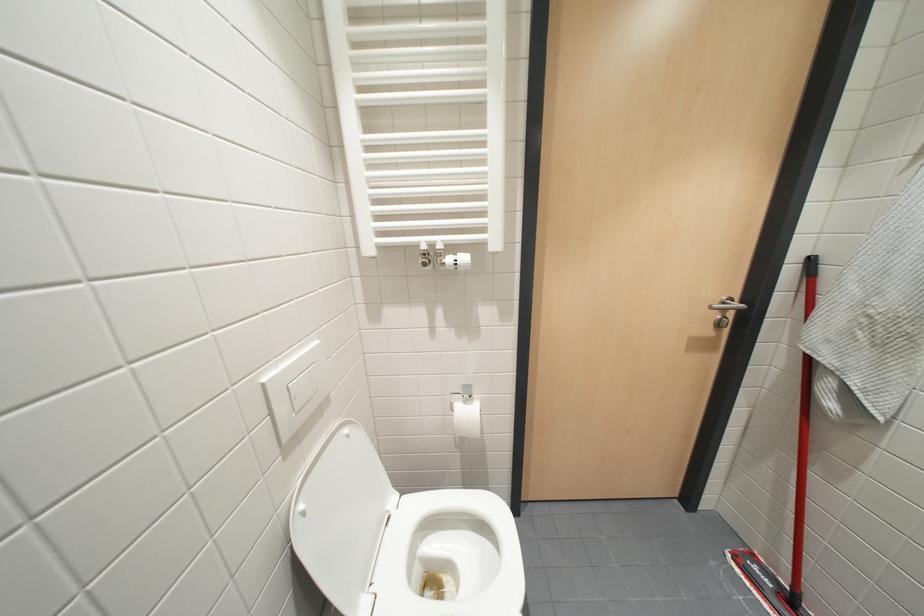
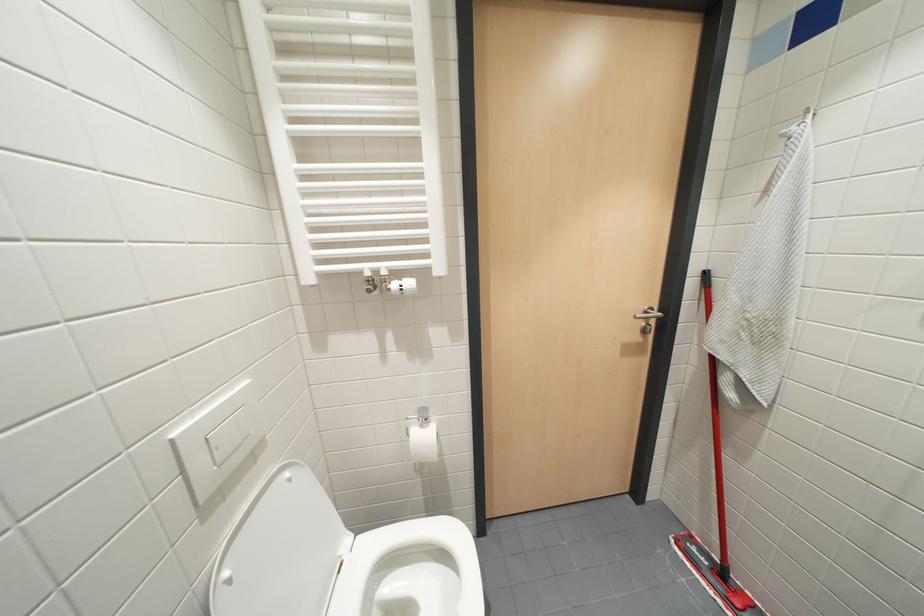
Question: Based on the continuous images, in which direction is the camera rotating? Reply with the corresponding letter.

Choices:
 (A) Left
 (B) Right
 (C) Up
 (D) Down

Answer: (B)